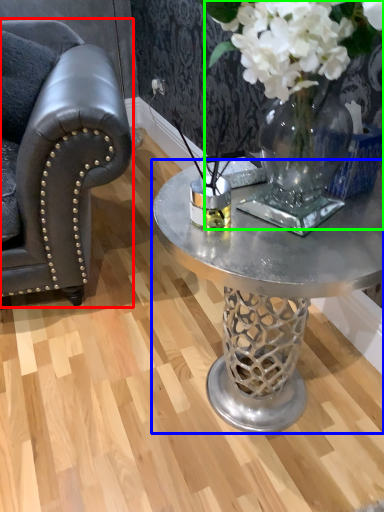
Question: Which object is positioned closest to chair (highlighted by a red box)? Select from coffee table (highlighted by a blue box) and floral arrangement (highlighted by a green box).

Choices:
 (A) coffee table
 (B) floral arrangement

Answer: (A)